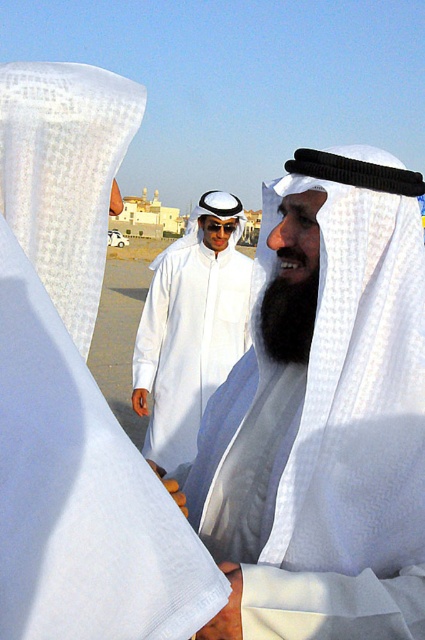
Question: Considering the real-world distances, which object is closest to the white sheer cloth at upper left?

Choices:
 (A) black fuzzy beard at center
 (B) white matte kandura at center

Answer: (A)

Question: Which object is farther from the camera taking this photo?

Choices:
 (A) black fuzzy beard at center
 (B) white sheer cloth at upper left

Answer: (A)

Question: Based on their relative distances, which object is nearer to the black fuzzy beard at center?

Choices:
 (A) white textured robe at center
 (B) white matte kandura at center

Answer: (A)

Question: Is white textured robe at center above white matte kandura at center?

Choices:
 (A) yes
 (B) no

Answer: (B)

Question: Is white textured robe at center positioned in front of black fuzzy beard at center?

Choices:
 (A) no
 (B) yes

Answer: (B)

Question: Observing the image, what is the correct spatial positioning of white textured robe at center in reference to black fuzzy beard at center?

Choices:
 (A) below
 (B) above

Answer: (A)